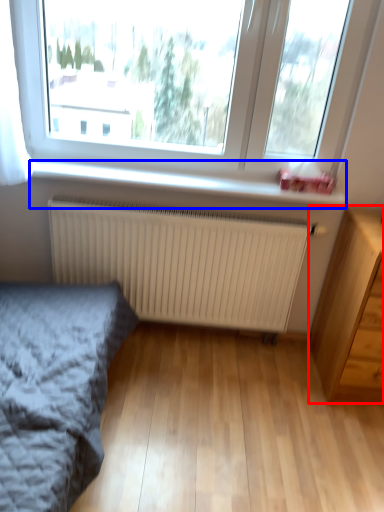
Question: Which of the following is the farthest to the observer, chest of drawers (highlighted by a red box) or window sill (highlighted by a blue box)?

Choices:
 (A) chest of drawers
 (B) window sill

Answer: (B)